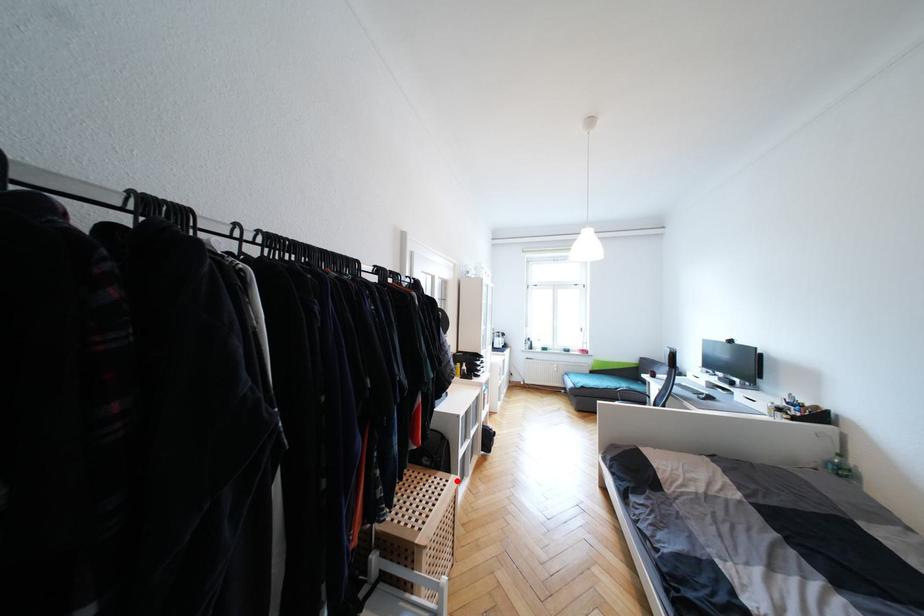
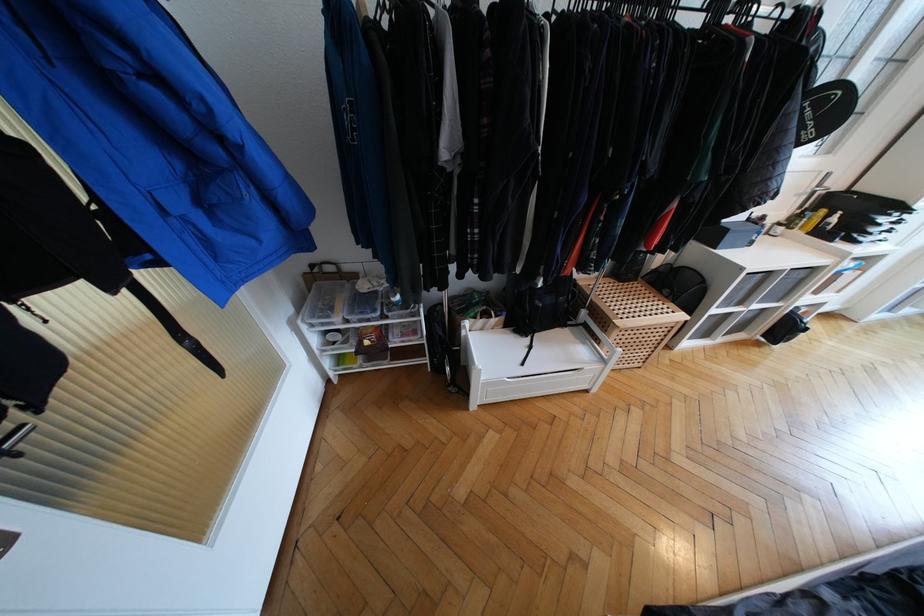
Locate, in the second image, the point that corresponds to the highlighted location in the first image.

(685, 317)